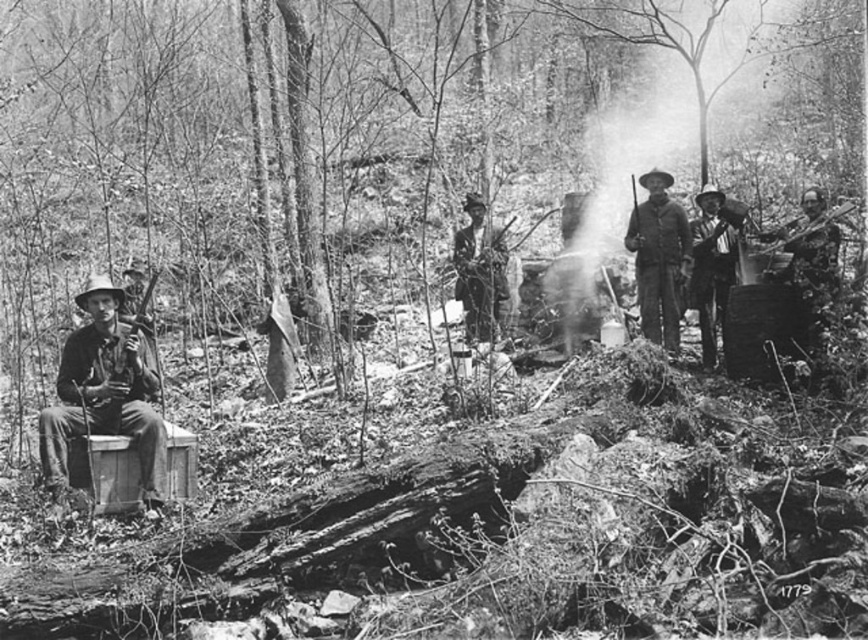
You are an observer in the scene and need to determine which item is taller between the rugged leather jacket at center and the smooth leather hat at center. Based on the description, which one is shorter?

The rugged leather jacket at center is shorter than the smooth leather hat at center.

Looking at this image, you are standing at the camera position and want to pick up the matte wooden bucket at left. Is it within your immediate reach?

The matte wooden bucket at left is 18.11 feet away from camera, so it is too far to reach immediately. You would need to move closer.

You are navigating a forest path and need to locate the smooth leather hat at center. According to the coordinates provided, where should you look relative to the center of the image?

The smooth leather hat at center is located at coordinates point 0.409 on the x axis and 0.823 on the y axis, so you should look slightly to the right and below the center of the image.